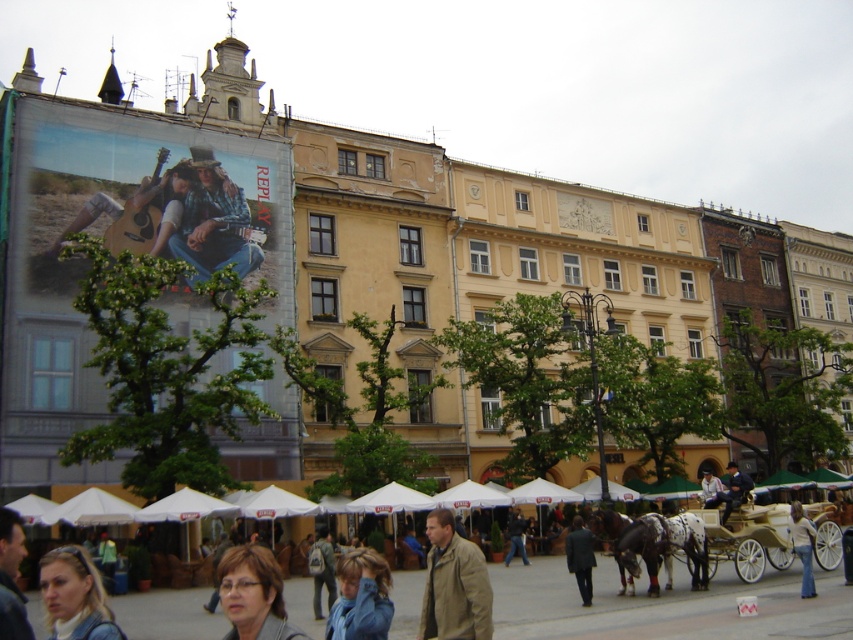
Question: Which of the following is the closest to the observer?

Choices:
 (A) blonde hair at lower left
 (B) light brown leather jacket at lower right
 (C) dark blue jeans at center
 (D) tan leather jacket at center

Answer: (A)

Question: Which object appears closest to the camera in this image?

Choices:
 (A) light brown leather jacket at lower right
 (B) white denim jeans at lower right

Answer: (B)

Question: Which of the following is the farthest from the observer?

Choices:
 (A) dark gray backpack at center
 (B) white denim jeans at lower right

Answer: (A)

Question: Does matte gray jacket at lower center have a smaller size compared to matte black jacket at lower left?

Choices:
 (A) no
 (B) yes

Answer: (A)

Question: Observing the image, what is the correct spatial positioning of blonde hair at lower left in reference to white denim jeans at lower right?

Choices:
 (A) below
 (B) above

Answer: (B)

Question: Is blonde hair at lower left bigger than dark blue jeans at center?

Choices:
 (A) no
 (B) yes

Answer: (B)